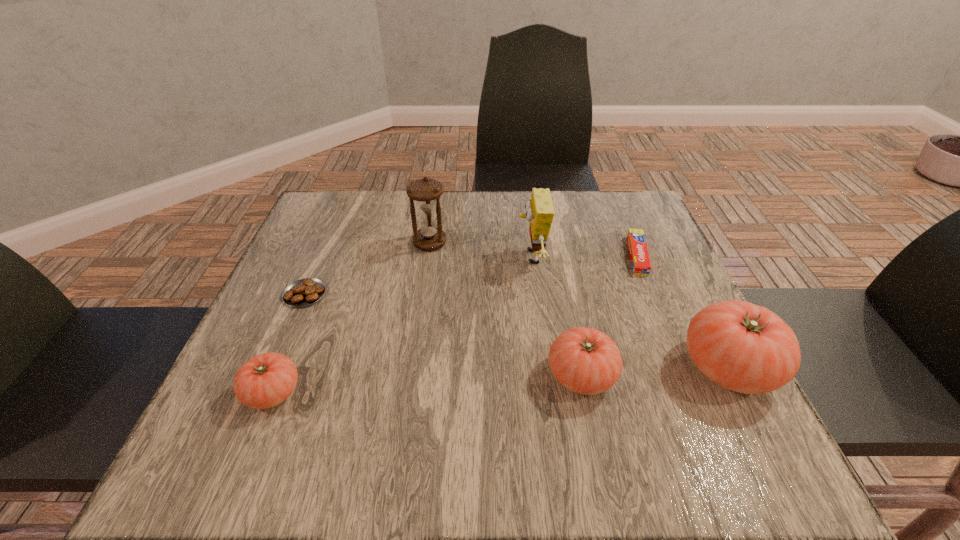
At what (x,y) coordinates should I click in order to perform the action: click on tomato object that ranks as the second closest to the hourglass. Please return your answer as a coordinate pair (x, y). The image size is (960, 540). Looking at the image, I should click on (266, 380).

Image resolution: width=960 pixels, height=540 pixels. In order to click on vacant space that satisfies the following two spatial constraints: 1. on the face of the sponge; 2. on the right side of the fourth shortest object in this screenshot , I will do `click(546, 376)`.

Image resolution: width=960 pixels, height=540 pixels. I want to click on free space in the image that satisfies the following two spatial constraints: 1. on the back side of the second tallest tomato; 2. on the right side of the toothpaste, so click(557, 255).

Where is `vacant area in the image that satisfies the following two spatial constraints: 1. on the back side of the toothpaste; 2. on the right side of the second tallest tomato`? The image size is (960, 540). vacant area in the image that satisfies the following two spatial constraints: 1. on the back side of the toothpaste; 2. on the right side of the second tallest tomato is located at coordinates (557, 255).

The width and height of the screenshot is (960, 540). Find the location of `free space that satisfies the following two spatial constraints: 1. on the back side of the second tomato from right to left; 2. on the left side of the rightmost tomato`. free space that satisfies the following two spatial constraints: 1. on the back side of the second tomato from right to left; 2. on the left side of the rightmost tomato is located at coordinates (580, 368).